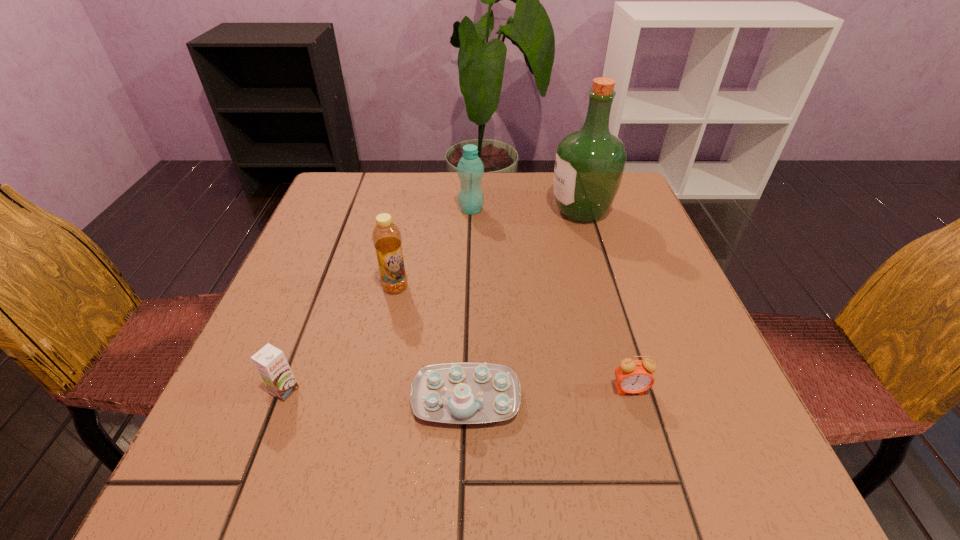
You are a GUI agent. You are given a task and a screenshot of the screen. Output one action in this format:
    pyautogui.click(x=<x>, y=<y>)
    Task: Click on the object present at the far right corner
    The height and width of the screenshot is (540, 960).
    Given the screenshot: What is the action you would take?
    pyautogui.click(x=589, y=164)

This screenshot has width=960, height=540. In the image, there is a desktop. In order to click on vacant space at the far edge in this screenshot , I will do `click(462, 219)`.

In the image, there is a desktop. Identify the location of vacant region at the left edge. (306, 330).

Where is `vacant space at the right edge of the desktop`? Image resolution: width=960 pixels, height=540 pixels. vacant space at the right edge of the desktop is located at coordinates (663, 379).

Find the location of a particular element. free space at the far left corner of the desktop is located at coordinates (351, 204).

Locate an element on the screen. free space between the left bottle and the tallest object is located at coordinates (488, 249).

Where is `free space that is in between the farther bottle and the leftmost object`? Image resolution: width=960 pixels, height=540 pixels. free space that is in between the farther bottle and the leftmost object is located at coordinates (377, 300).

Locate an element on the screen. free space between the alarm clock and the right bottle is located at coordinates (550, 300).

Where is `empty location between the fifth object from right to left and the leftmost object`? This screenshot has width=960, height=540. empty location between the fifth object from right to left and the leftmost object is located at coordinates (340, 339).

This screenshot has width=960, height=540. What are the coordinates of `unoccupied area between the right bottle and the chinaware` in the screenshot? It's located at (468, 304).